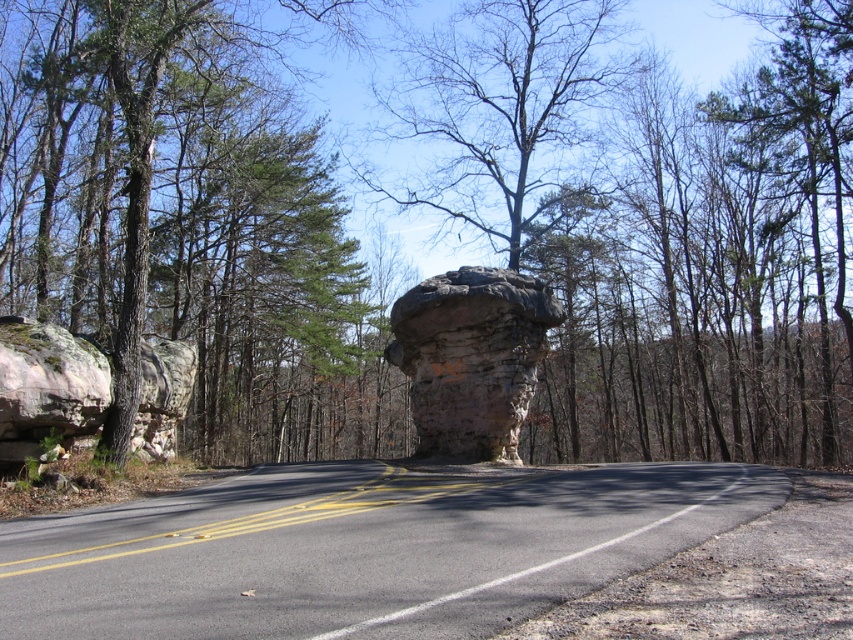
You are driving a car that is 5 meters long. You need to make a U turn on the road between the green mossy rock at center and the rustic stone boulder at left. Is there enough space to do so?

The distance between the green mossy rock at center and the rustic stone boulder at left is 12.49 meters. Since the car is 5 meters long, there is sufficient space to make a U turn between them.

You are driving along the scenic road and see the green mossy rock at center and the rusty stone formation at center. Which one is located to the left when facing the direction the road curves?

The green mossy rock at center is positioned on the left side of the rusty stone formation at center, so when facing the direction the road curves to the right, the green mossy rock at center would be on the left side.

From the picture: You are a hiker trying to determine the best path through the forest. You see a green mossy rock at center and a rusty stone formation at center. Which object is taller?

The green mossy rock at center is taller than the rusty stone formation at center.